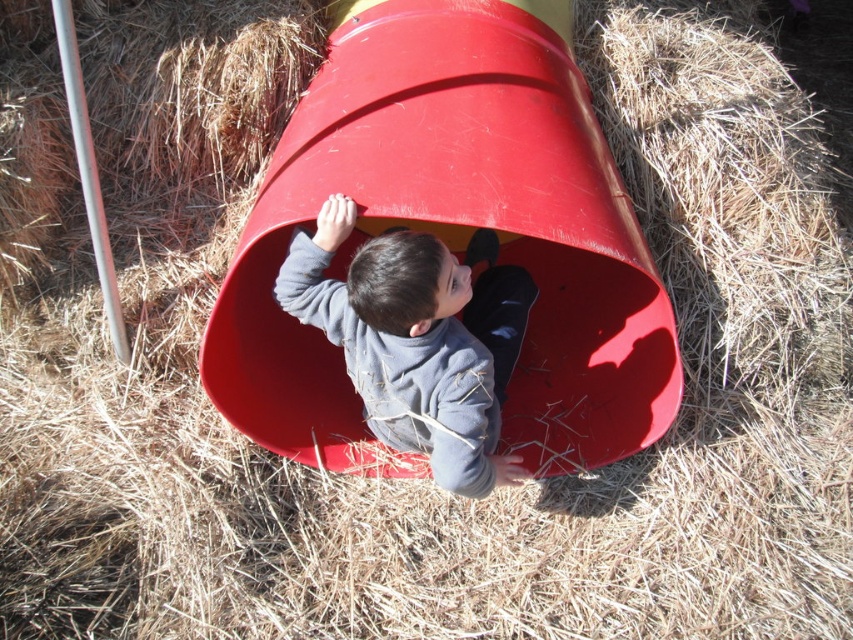
Is smooth plastic slide at center to the left of matte gray sweater at center from the viewer's perspective?

In fact, smooth plastic slide at center is to the right of matte gray sweater at center.

Between smooth plastic slide at center and matte gray sweater at center, which one appears on the left side from the viewer's perspective?

Positioned to the left is matte gray sweater at center.

This screenshot has width=853, height=640. What do you see at coordinates (454, 236) in the screenshot?
I see `smooth plastic slide at center` at bounding box center [454, 236].

This screenshot has width=853, height=640. I want to click on smooth plastic slide at center, so click(x=454, y=236).